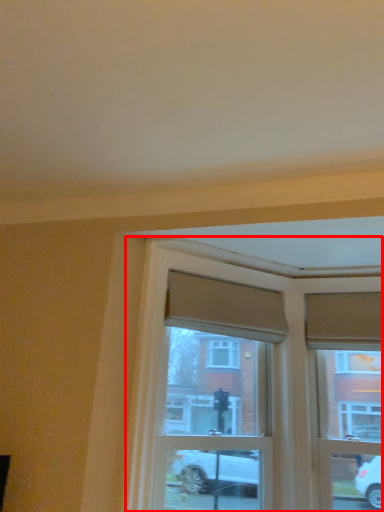
Question: From the image's perspective, where is window (annotated by the red box) located in relation to window frame in the image?

Choices:
 (A) below
 (B) above

Answer: (B)